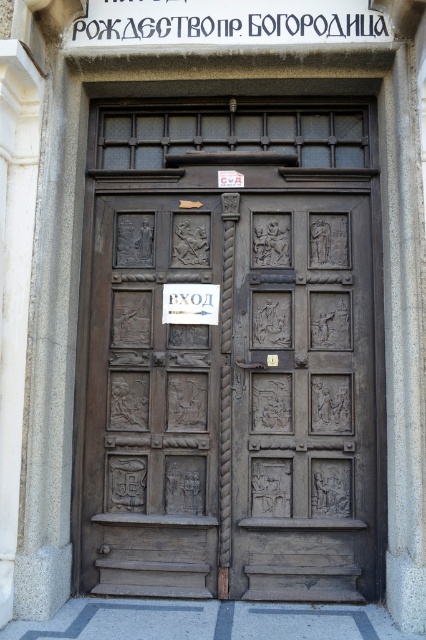
Question: Which point is closer to the camera?

Choices:
 (A) brown carved wood door at center
 (B) dark brown wood door at center
 (C) dark wood door at center

Answer: (A)

Question: Can you confirm if brown carved wood door at center is wider than dark brown wood door at center?

Choices:
 (A) yes
 (B) no

Answer: (A)

Question: Is dark wood door at center to the right of dark brown wood door at center from the viewer's perspective?

Choices:
 (A) yes
 (B) no

Answer: (A)

Question: Based on their relative distances, which object is farther from the dark wood door at center?

Choices:
 (A) brown carved wood door at center
 (B) dark brown wood door at center

Answer: (B)

Question: Is brown carved wood door at center thinner than dark brown wood door at center?

Choices:
 (A) no
 (B) yes

Answer: (A)

Question: Which object is closer to the camera taking this photo?

Choices:
 (A) brown carved wood door at center
 (B) dark wood door at center

Answer: (A)